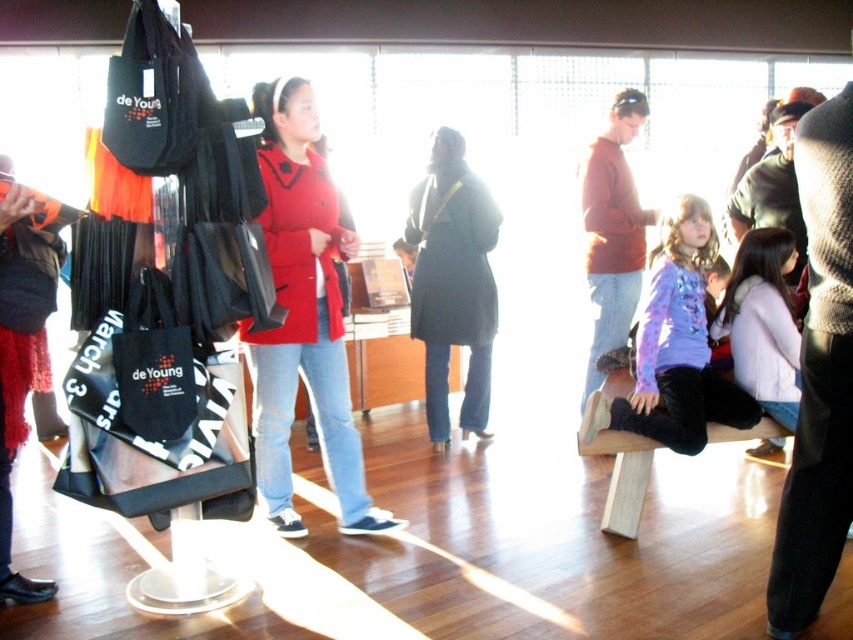
Is purple sweater at center bigger than black canvas tote at center?

Correct, purple sweater at center is larger in size than black canvas tote at center.

Does purple sweater at center appear over black canvas tote at center?

Yes.

Does point (787, 358) lie behind point (178, 397)?

Yes.

Find the location of `purple sweater at center`. purple sweater at center is located at coordinates (763, 323).

Does point (260, 145) come farther from viewer compared to point (605, 173)?

No, (260, 145) is closer to viewer.

Describe the element at coordinates (303, 316) in the screenshot. The height and width of the screenshot is (640, 853). I see `matte red coat at center` at that location.

Which is behind, point (271, 99) or point (612, 113)?

The point (612, 113) is more distant.

Locate an element on the screen. Image resolution: width=853 pixels, height=640 pixels. matte red coat at center is located at coordinates (303, 316).

Who is positioned more to the right, dark gray coat at center or black canvas tote at center?

From the viewer's perspective, dark gray coat at center appears more on the right side.

Locate an element on the screen. The width and height of the screenshot is (853, 640). dark gray coat at center is located at coordinates (453, 282).

This screenshot has width=853, height=640. I want to click on dark gray coat at center, so click(x=453, y=282).

You are a GUI agent. You are given a task and a screenshot of the screen. Output one action in this format:
    pyautogui.click(x=<x>, y=<y>)
    Task: Click on the dark gray coat at center
    
    Given the screenshot: What is the action you would take?
    pyautogui.click(x=453, y=282)